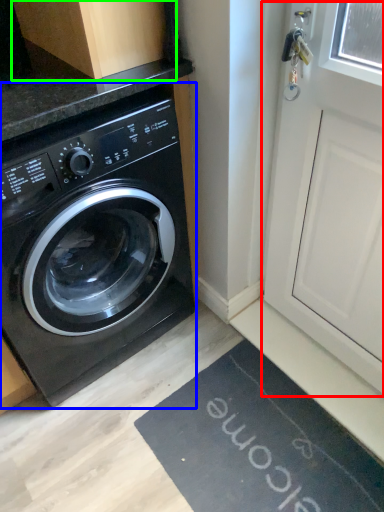
Question: Which object is positioned farthest from screen door (highlighted by a red box)? Select from washing machine (highlighted by a blue box) and cabinetry (highlighted by a green box).

Choices:
 (A) washing machine
 (B) cabinetry

Answer: (B)